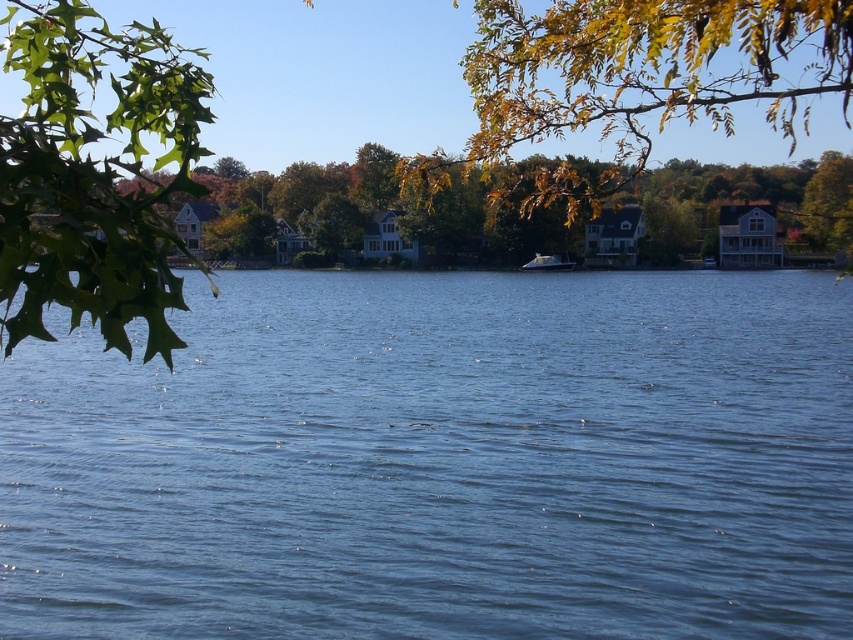
You are standing at the lakeside and want to take a photo of the green leafy branch at upper left. If your camera can focus on objects up to 3 meters away, will it be able to capture the branch clearly?

The green leafy branch at upper left is 2.93 meters away from camera, so yes, the camera can focus on it clearly since it is within the 3 meters range.